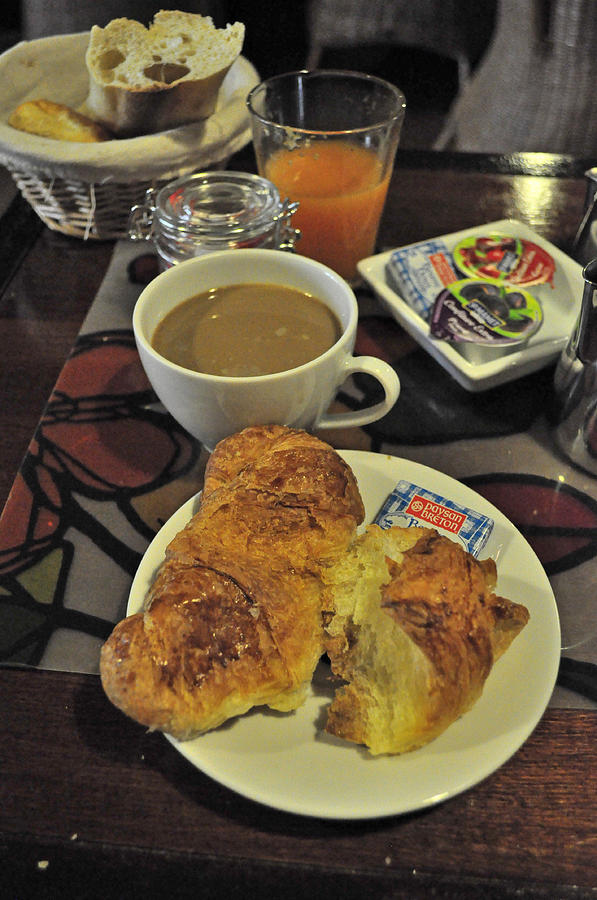
Identify the location of small coffee plate. (276, 760).